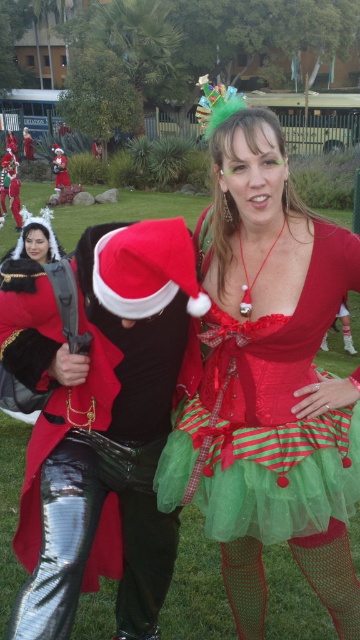
Question: Which point is farther to the camera?

Choices:
 (A) (277, 388)
 (B) (57, 333)

Answer: (A)

Question: Which object is farther from the camera taking this photo?

Choices:
 (A) shiny black pants at center
 (B) shiny red dress at center

Answer: (B)

Question: Is shiny red dress at center further to camera compared to shiny black pants at center?

Choices:
 (A) no
 (B) yes

Answer: (B)

Question: Can you confirm if shiny red dress at center is wider than shiny black pants at center?

Choices:
 (A) yes
 (B) no

Answer: (A)

Question: Is shiny red dress at center thinner than shiny black pants at center?

Choices:
 (A) no
 (B) yes

Answer: (A)